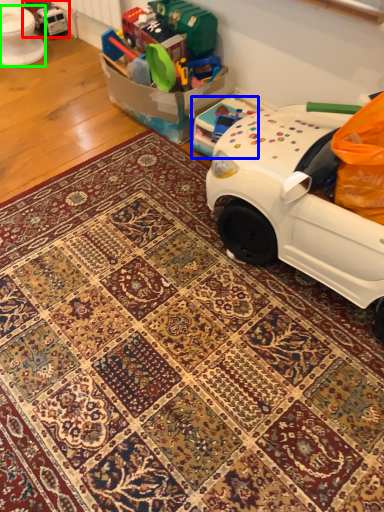
Question: Based on their relative distances, which object is nearer to toy (highlighted by a red box)? Choose from toy (highlighted by a blue box) and toilet bowl (highlighted by a green box).

Choices:
 (A) toy
 (B) toilet bowl

Answer: (B)